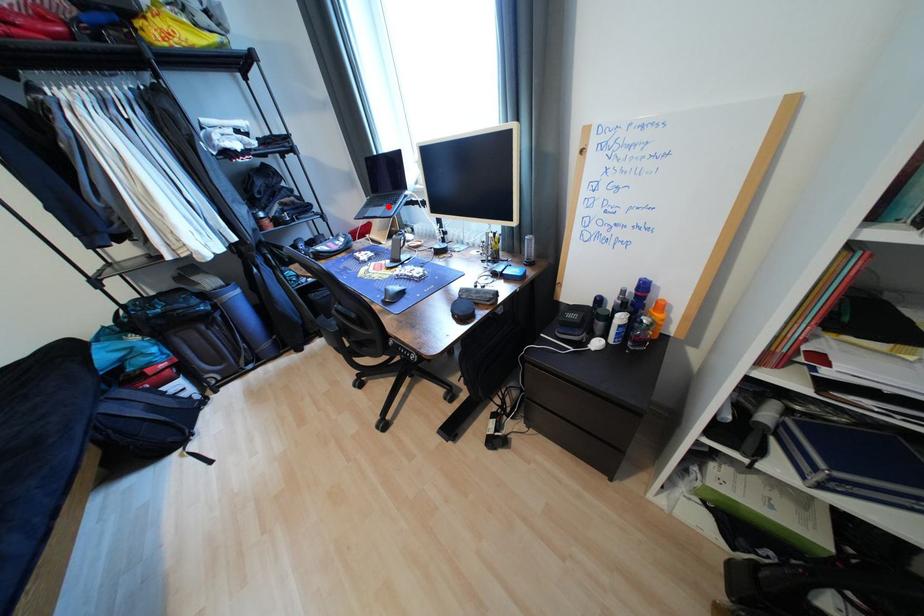
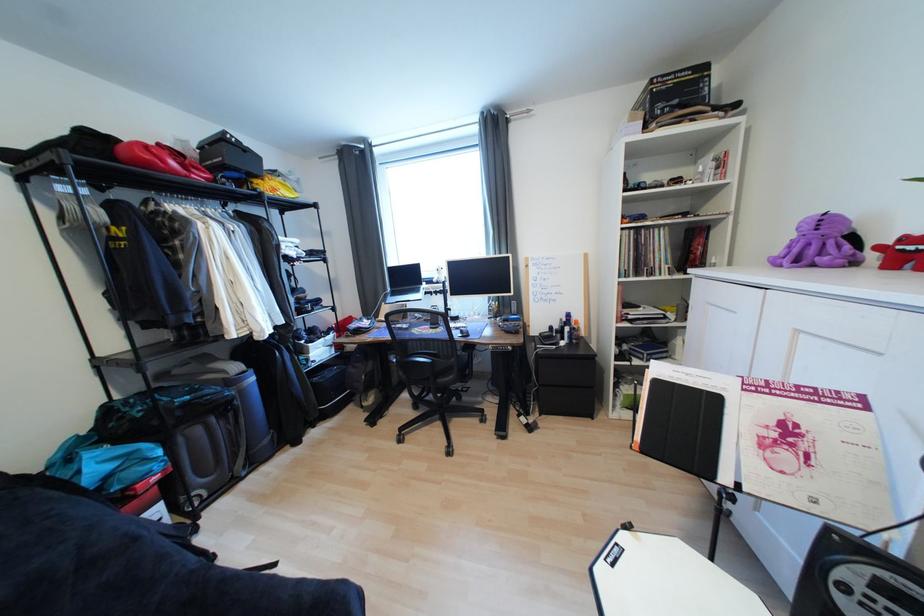
Question: I am providing you with two images of the same scene from different viewpoints. A red point is shown in image1. For the corresponding object point in image2, is it positioned nearer or farther from the camera?

Choices:
 (A) Nearer
 (B) Farther

Answer: (B)